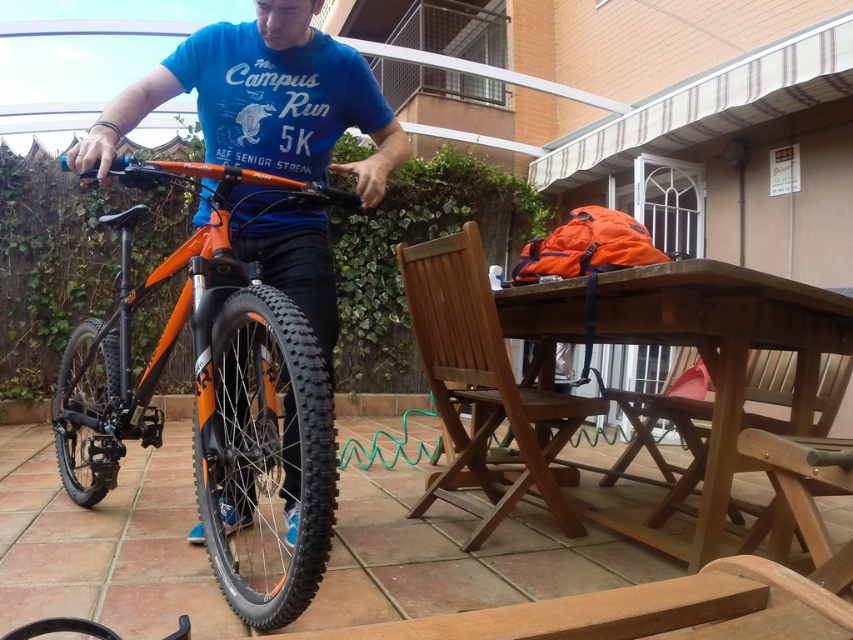
How distant is orange matte bicycle at center from brown wooden table at center?

They are 34.01 inches apart.

From the picture: Between orange matte bicycle at center and brown wooden table at center, which one has more height?

With more height is orange matte bicycle at center.

Is point (300, 289) farther from viewer compared to point (598, 298)?

That is False.

Locate an element on the screen. This screenshot has height=640, width=853. orange matte bicycle at center is located at coordinates (265, 99).